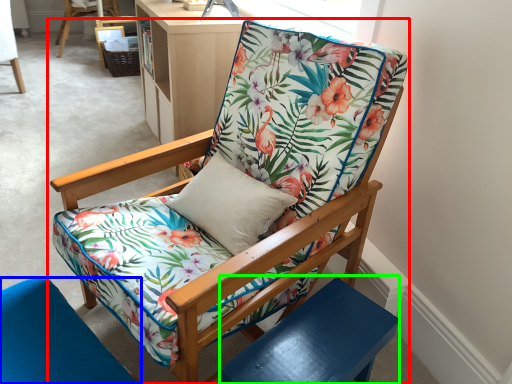
Question: Which is farther away from chair (highlighted by a red box)? chair (highlighted by a blue box) or side table (highlighted by a green box)?

Choices:
 (A) chair
 (B) side table

Answer: (A)